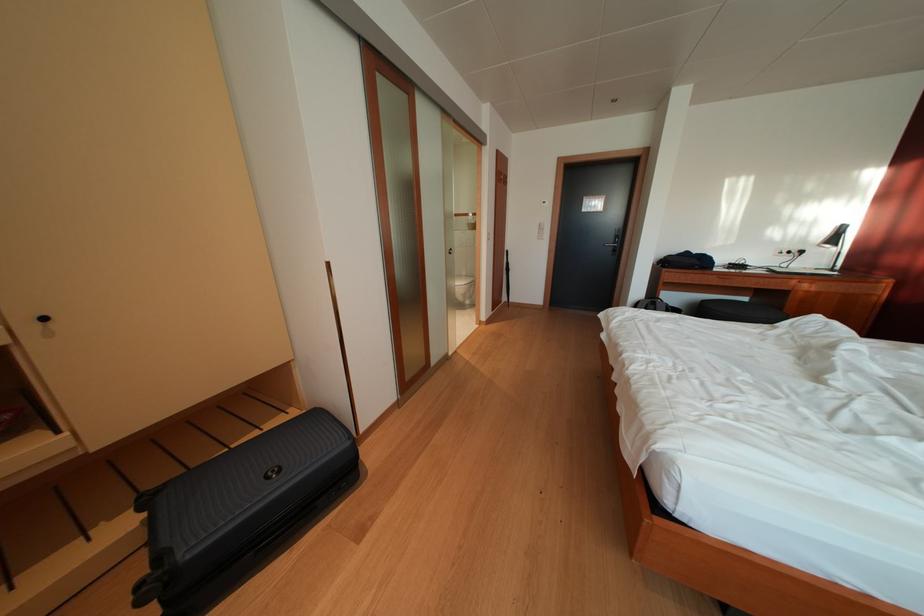
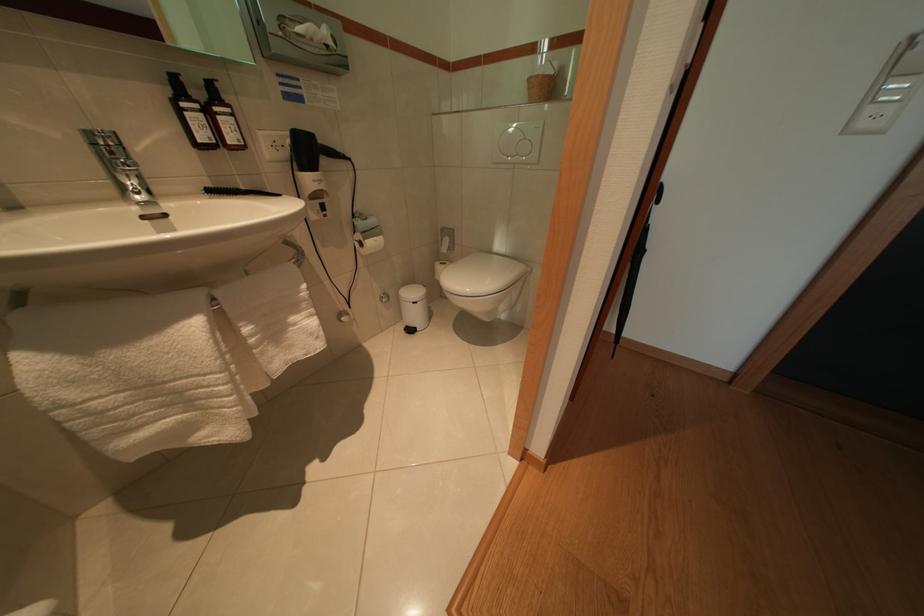
Question: Which direction would the cameraman need to move to produce the second image? Reply with the corresponding letter.

Choices:
 (A) Left
 (B) Right
 (C) Forward
 (D) Backward

Answer: (C)